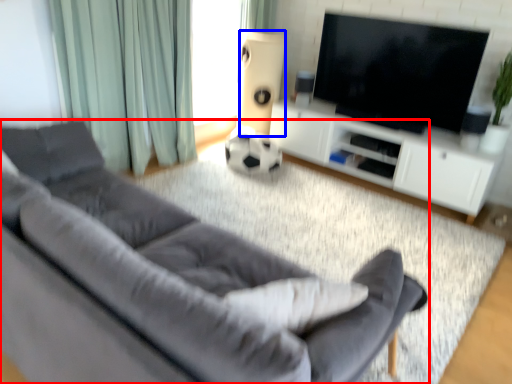
Question: Which object appears farthest to the camera in this image, studio couch (highlighted by a red box) or speaker (highlighted by a blue box)?

Choices:
 (A) studio couch
 (B) speaker

Answer: (B)